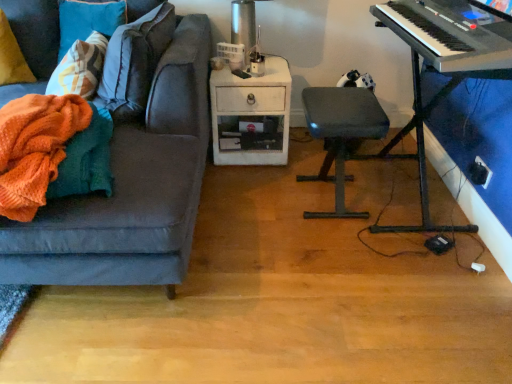
The width and height of the screenshot is (512, 384). Find the location of `vacant space underneath matte gray stool at center (from a real-world perspective)`. vacant space underneath matte gray stool at center (from a real-world perspective) is located at coordinates (322, 199).